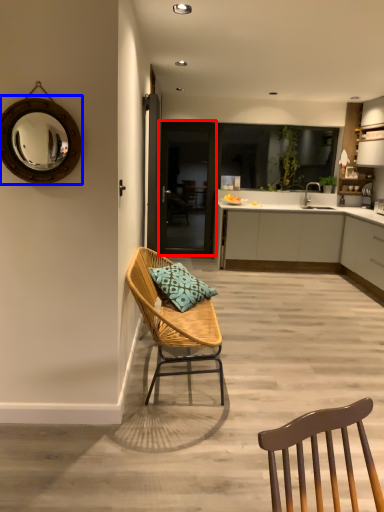
Question: Which object is further to the camera taking this photo, glass door (highlighted by a red box) or mirror (highlighted by a blue box)?

Choices:
 (A) glass door
 (B) mirror

Answer: (A)